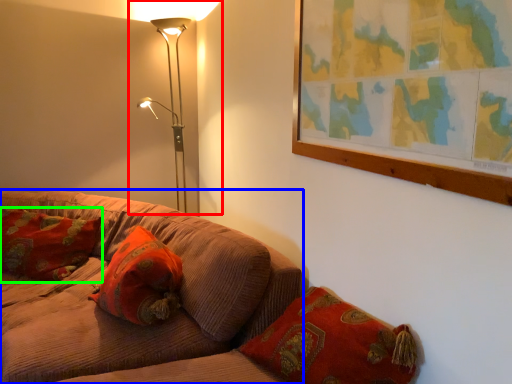
Question: Considering the real-world distances, which object is closest to lamp (highlighted by a red box)? studio couch (highlighted by a blue box) or pillow (highlighted by a green box).

Choices:
 (A) studio couch
 (B) pillow

Answer: (B)